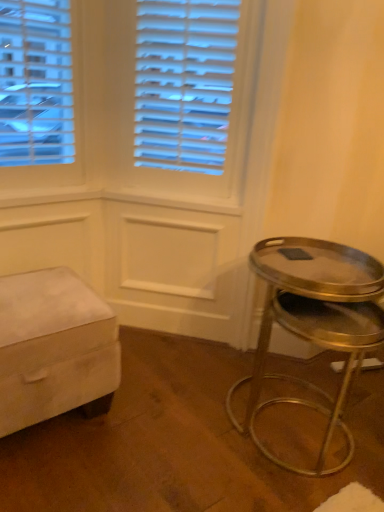
Identify the location of vacant space situated above velvet beige ottoman at lower left (from a real-world perspective). This screenshot has width=384, height=512. (40, 302).